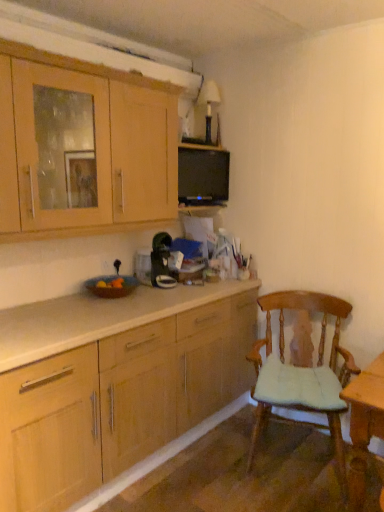
What do you see at coordinates (302, 371) in the screenshot? I see `wooden chair with cushion at right` at bounding box center [302, 371].

Identify the location of wooden chair with cushion at right. (302, 371).

This screenshot has width=384, height=512. Describe the element at coordinates (96, 143) in the screenshot. I see `wooden cabinet at upper left` at that location.

This screenshot has width=384, height=512. In order to click on wooden cabinet at upper left in this screenshot , I will do `click(96, 143)`.

The height and width of the screenshot is (512, 384). I want to click on wooden chair with cushion at right, so click(x=302, y=371).

Which is more to the right, wooden cabinet at upper left or wooden chair with cushion at right?

wooden chair with cushion at right is more to the right.

Is the position of wooden cabinet at upper left less distant than that of wooden chair with cushion at right?

Yes, it is.

Considering the points (25, 62) and (284, 291), which point is behind, point (25, 62) or point (284, 291)?

Positioned behind is point (284, 291).

From the image's perspective, which one is positioned higher, wooden cabinet at upper left or wooden chair with cushion at right?

wooden cabinet at upper left.

From the picture: From a real-world perspective, relative to wooden chair with cushion at right, is wooden cabinet at upper left vertically above or below?

wooden cabinet at upper left is above wooden chair with cushion at right.

Considering the relative sizes of wooden cabinet at upper left and wooden chair with cushion at right in the image provided, is wooden cabinet at upper left thinner than wooden chair with cushion at right?

Yes.

Considering the sizes of wooden cabinet at upper left and wooden chair with cushion at right in the image, is wooden cabinet at upper left taller or shorter than wooden chair with cushion at right?

Considering their sizes, wooden cabinet at upper left has less height than wooden chair with cushion at right.

Looking at this image, who is smaller, wooden cabinet at upper left or wooden chair with cushion at right?

wooden cabinet at upper left is smaller.

Based on the photo, do you think wooden cabinet at upper left is within wooden chair with cushion at right, or outside of it?

wooden cabinet at upper left exists outside the volume of wooden chair with cushion at right.

Would you say wooden cabinet at upper left is a long distance from wooden chair with cushion at right?

wooden cabinet at upper left is positioned a significant distance from wooden chair with cushion at right.

Is wooden cabinet at upper left positioned with its back to wooden chair with cushion at right?

wooden cabinet at upper left does not have its back to wooden chair with cushion at right.

Where is `chair located on the right of wooden cabinet at upper left`? This screenshot has width=384, height=512. chair located on the right of wooden cabinet at upper left is located at coordinates (302, 371).

Which object is positioned more to the right, wooden chair with cushion at right or wooden cabinet at upper left?

Positioned to the right is wooden chair with cushion at right.

Which is behind, wooden chair with cushion at right or wooden cabinet at upper left?

wooden chair with cushion at right is more distant.

Between point (321, 426) and point (142, 225), which one is positioned behind?

Positioned behind is point (321, 426).

From the image's perspective, which one is positioned higher, wooden chair with cushion at right or wooden cabinet at upper left?

wooden cabinet at upper left.

Looking at this image, from a real-world perspective, is wooden chair with cushion at right located higher than wooden cabinet at upper left?

No.

Which of these two, wooden chair with cushion at right or wooden cabinet at upper left, is thinner?

wooden cabinet at upper left is thinner.

Who is shorter, wooden chair with cushion at right or wooden cabinet at upper left?

wooden cabinet at upper left.

Does wooden chair with cushion at right have a larger size compared to wooden cabinet at upper left?

Yes, wooden chair with cushion at right is bigger than wooden cabinet at upper left.

Do you think wooden chair with cushion at right is within wooden cabinet at upper left, or outside of it?

wooden chair with cushion at right lies outside wooden cabinet at upper left.

Is wooden chair with cushion at right with wooden cabinet at upper left?

They are not placed beside each other.

Is wooden chair with cushion at right turned away from wooden cabinet at upper left?

That's not correct — wooden chair with cushion at right is not looking away from wooden cabinet at upper left.

Can you tell me how much wooden chair with cushion at right and wooden cabinet at upper left differ in facing direction?

They differ by 65 degrees in their facing directions.

Measure the distance from wooden chair with cushion at right to wooden cabinet at upper left.

1.26 meters.

Identify the location of cabinetry positioned vertically above the wooden chair with cushion at right (from a real-world perspective). This screenshot has height=512, width=384. (96, 143).

Identify the location of chair on the right of wooden cabinet at upper left. This screenshot has width=384, height=512. (302, 371).

The image size is (384, 512). In order to click on cabinetry above the wooden chair with cushion at right (from the image's perspective) in this screenshot , I will do `click(96, 143)`.